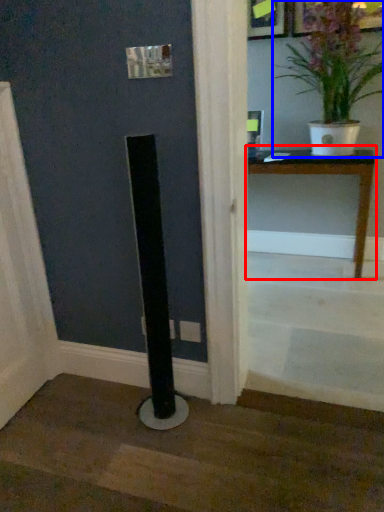
Question: Which object is further to the camera taking this photo, table (highlighted by a red box) or houseplant (highlighted by a blue box)?

Choices:
 (A) table
 (B) houseplant

Answer: (A)